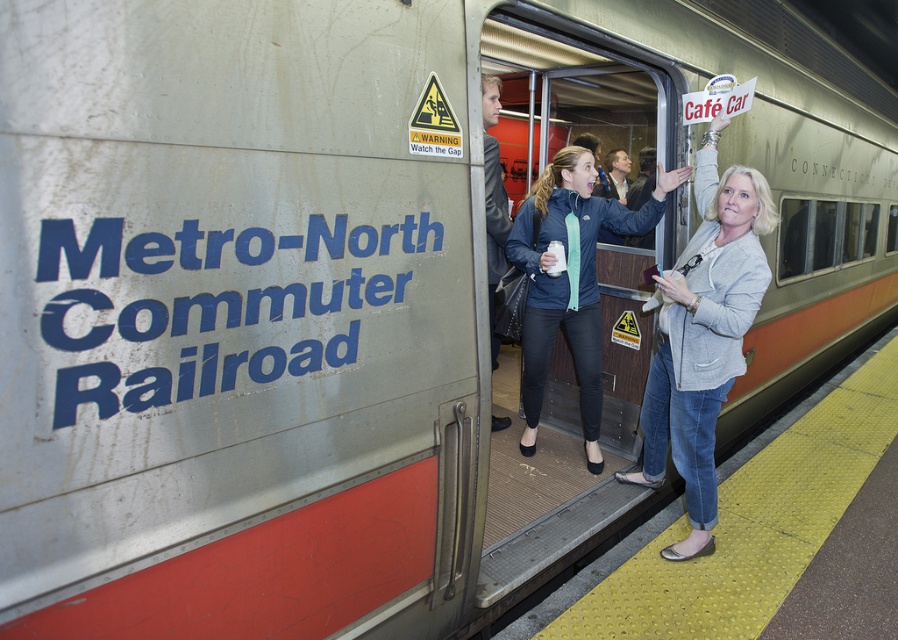
You are a passenger at the Metro North train station and you see the light gray blazer at center. Where is it located in the image?

The light gray blazer at center is located at the coordinates point (703, 333).